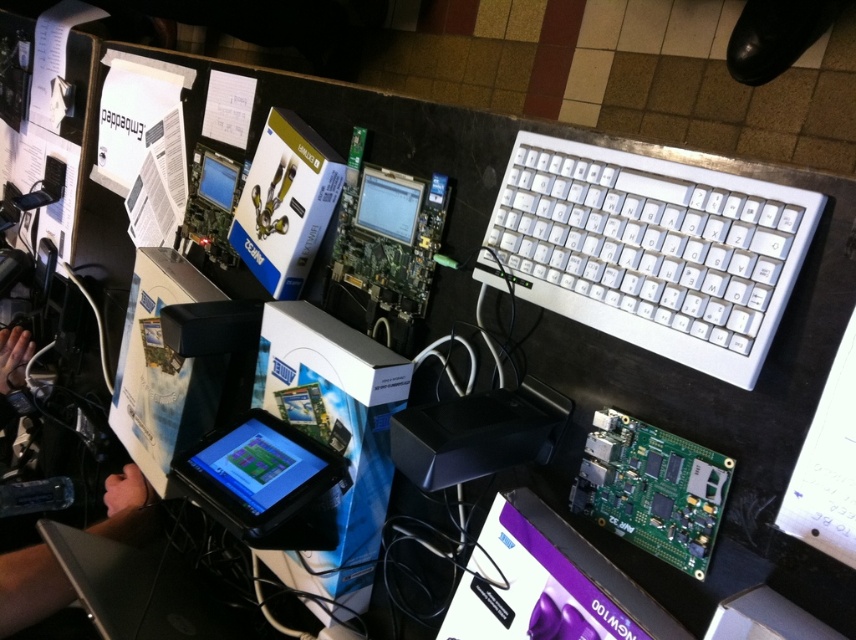
You are a delivery robot trying to navigate to a specific location in the workspace. You need to move from the current position to a point closer to the camera. Which of the two points, point (782, 209) or point (57, 595), should you choose?

Point (782, 209) is closer to the camera than point (57, 595), so you should choose point (782, 209).

You are organizing the desk and need to place a new item between the keyboard and the matte black tablet at center. Which object is closer to the center of the desk?

The matte black tablet at center is already at the center, so it is closer to the center of the desk than the keyboard on the right.

You are setting up a dual monitor setup and need to place the matte black monitor at center and the matte black screen at upper center on your desk. Based on the image, which one should be placed lower on the desk to avoid blocking the view of the other?

The matte black monitor at center should be placed lower on the desk because it is positioned under the matte black screen at upper center in the image, meaning it is already lower and not blocking the view.